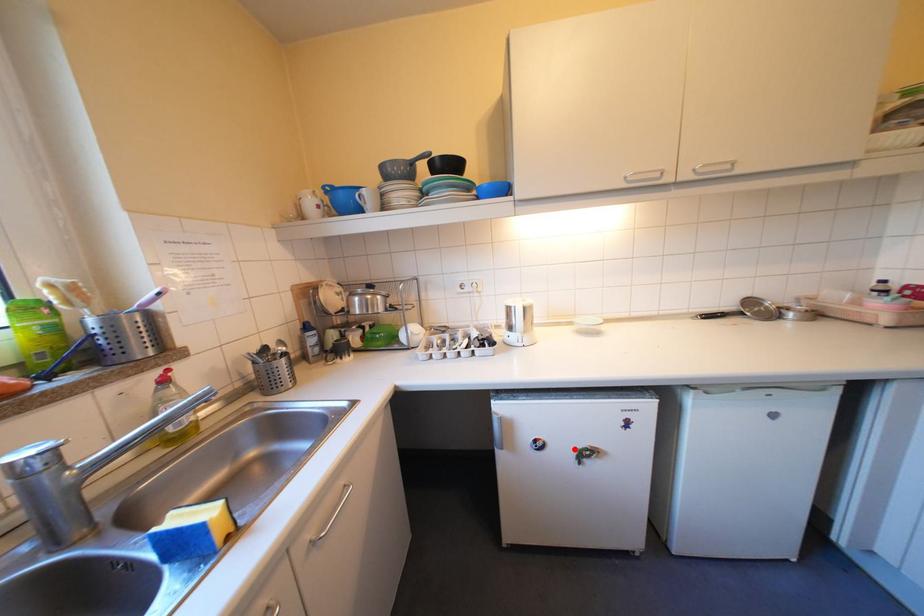
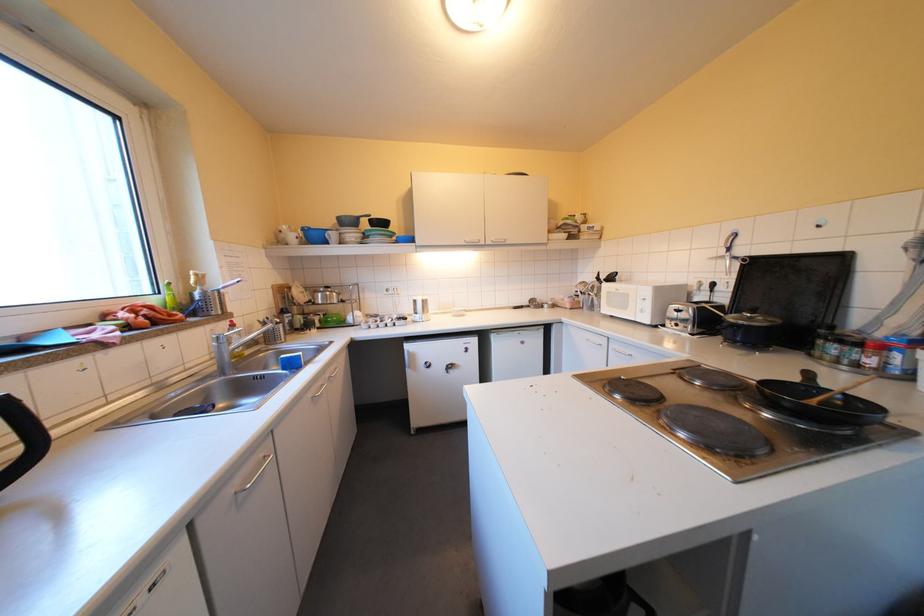
The point at the highlighted location is marked in the first image. Where is the corresponding point in the second image?

(452, 366)